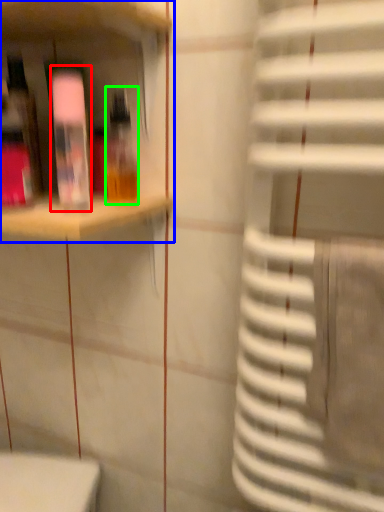
Question: Which object is positioned closest to bottle (highlighted by a red box)? Select from shelf (highlighted by a blue box) and bottle (highlighted by a green box).

Choices:
 (A) shelf
 (B) bottle

Answer: (A)